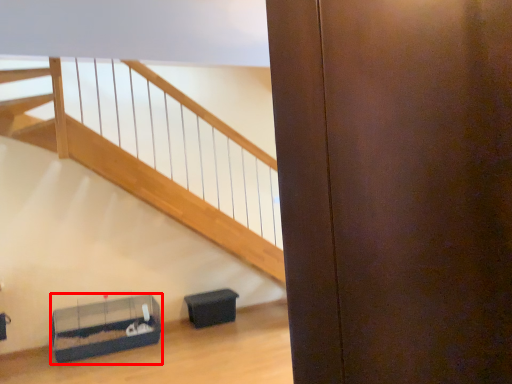
Question: From the image, what is the correct spatial relationship of furniture (annotated by the red box) in relation to furniture?

Choices:
 (A) left
 (B) right

Answer: (A)